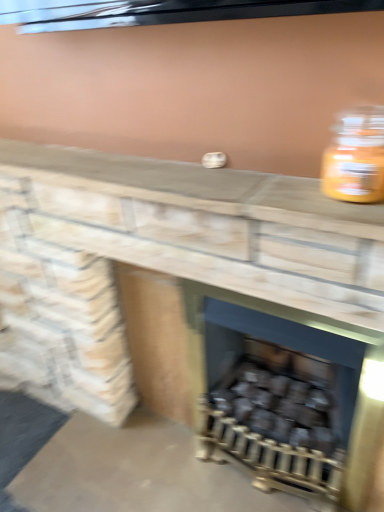
The height and width of the screenshot is (512, 384). In order to click on free location to the left of translucent glass jar at upper right in this screenshot , I will do `click(264, 192)`.